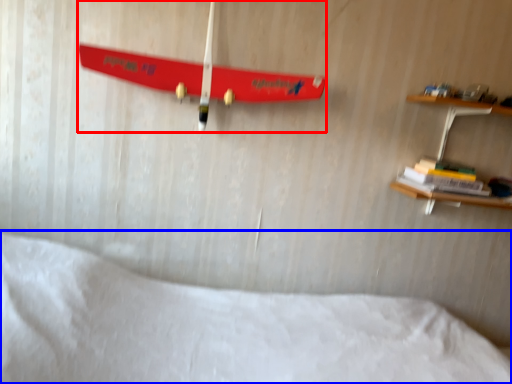
Question: Which object appears closest to the camera in this image, skateboard (highlighted by a red box) or bed (highlighted by a blue box)?

Choices:
 (A) skateboard
 (B) bed

Answer: (B)